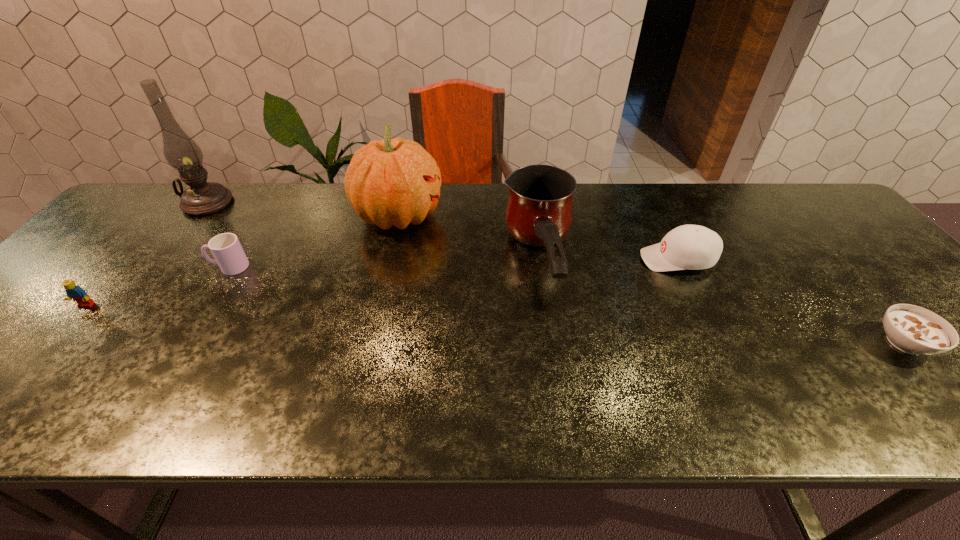
Find the location of `object that is the second closest to the tallest object`. object that is the second closest to the tallest object is located at coordinates (73, 291).

Locate an element on the screen. Image resolution: width=960 pixels, height=540 pixels. the sixth closest object to the cup is located at coordinates (912, 329).

Locate an element on the screen. This screenshot has height=540, width=960. vacant area in the image that satisfies the following two spatial constraints: 1. on the handle side of the third tallest object; 2. on the left side of the rightmost object is located at coordinates (551, 342).

I want to click on free spot that satisfies the following two spatial constraints: 1. on the carved face of the fourth object from right to left; 2. on the face of the Lego, so click(379, 305).

You are a GUI agent. You are given a task and a screenshot of the screen. Output one action in this format:
    pyautogui.click(x=<x>, y=<y>)
    Task: Click on the vacant region that satisfies the following two spatial constraints: 1. with the handle on the side of the fifth object from right to left; 2. on the front side of the tallest object
    
    Given the screenshot: What is the action you would take?
    pyautogui.click(x=268, y=203)

This screenshot has width=960, height=540. I want to click on vacant area in the image that satisfies the following two spatial constraints: 1. on the handle side of the rightmost object; 2. on the left side of the saucepan, so click(x=551, y=342).